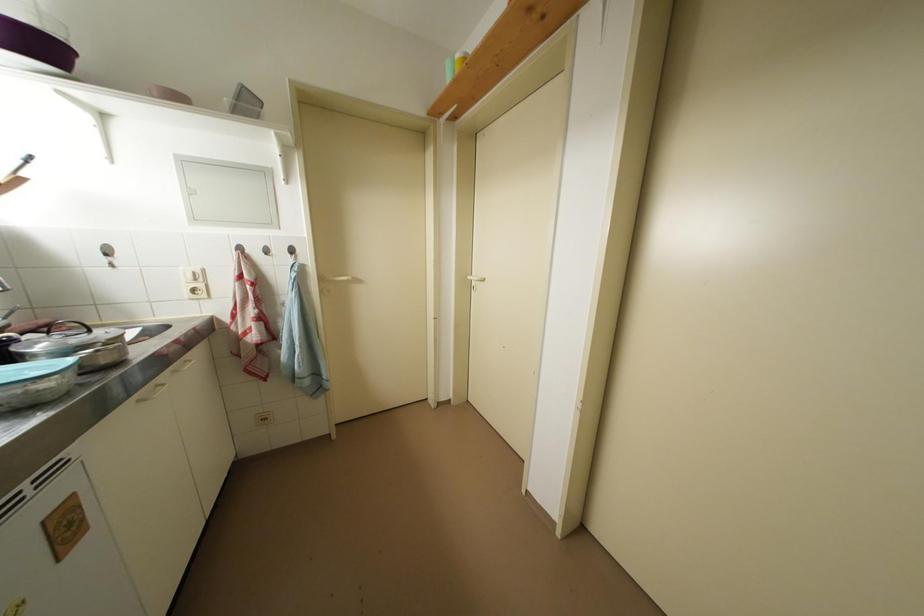
The height and width of the screenshot is (616, 924). In order to click on clear plastic container in this screenshot , I will do `click(35, 382)`.